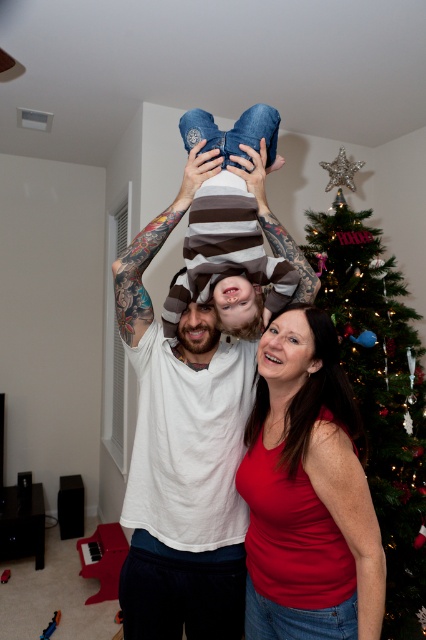
Describe the element at coordinates (379, 385) in the screenshot. The image size is (426, 640). I see `green glittery christmas tree at upper right` at that location.

Who is positioned more to the left, green glittery christmas tree at upper right or striped fabric head at center?

striped fabric head at center

Is point (351, 285) less distant than point (189, 355)?

No.

Image resolution: width=426 pixels, height=640 pixels. In order to click on green glittery christmas tree at upper right in this screenshot , I will do `click(379, 385)`.

Which of these two, denim jeans at center or matte red shirt at lower center, stands shorter?

Standing shorter between the two is matte red shirt at lower center.

The height and width of the screenshot is (640, 426). I want to click on denim jeans at center, so tap(230, 259).

Is point (222, 176) positioned behind point (334, 349)?

Yes, it is.

The height and width of the screenshot is (640, 426). Identify the location of denim jeans at center. click(230, 259).

Does white matte shirt at center have a larger size compared to striped fabric head at center?

Indeed, white matte shirt at center has a larger size compared to striped fabric head at center.

The width and height of the screenshot is (426, 640). What do you see at coordinates (183, 451) in the screenshot?
I see `white matte shirt at center` at bounding box center [183, 451].

The width and height of the screenshot is (426, 640). What are the coordinates of `white matte shirt at center` in the screenshot? It's located at (183, 451).